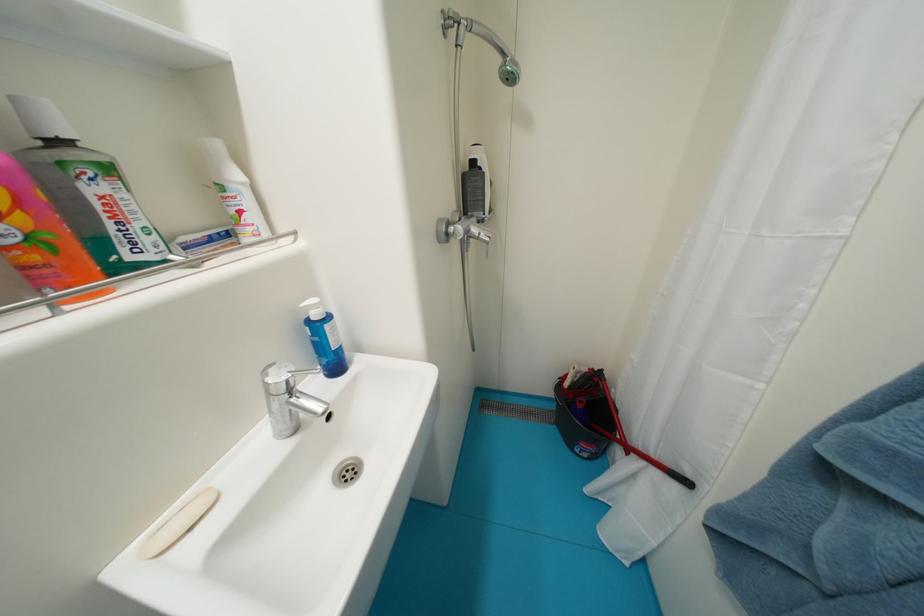
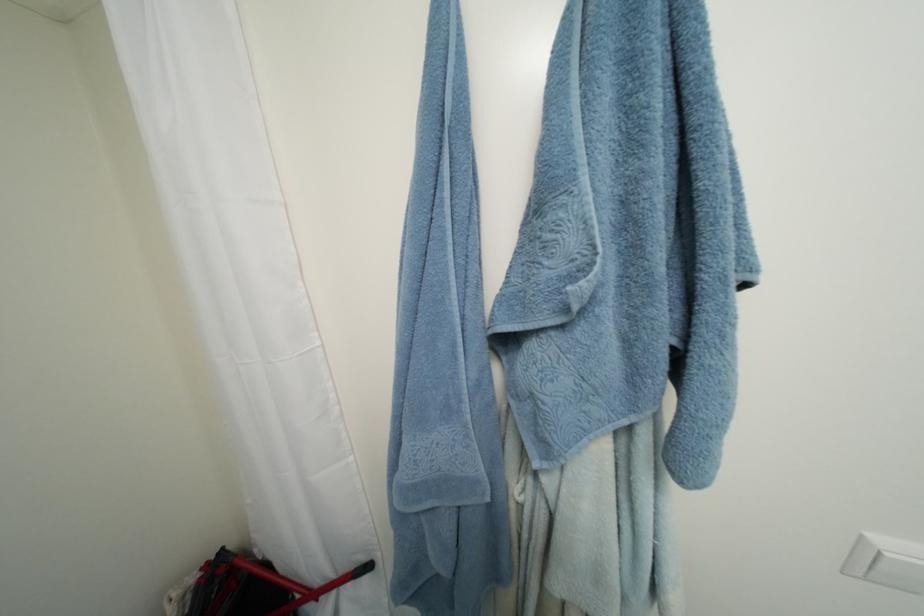
Find the pixel in the second image that matches pixel 608 371 in the first image.

(229, 552)